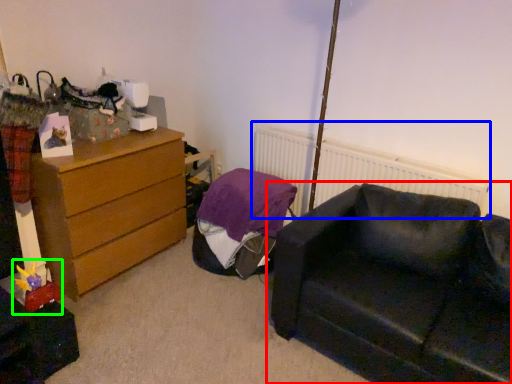
Question: Which is farther away from studio couch (highlighted by a red box)? radiator (highlighted by a blue box) or toy (highlighted by a green box)?

Choices:
 (A) radiator
 (B) toy

Answer: (B)